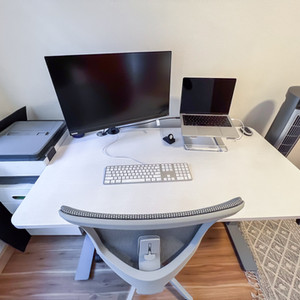
At what (x,y) coordinates should I click in order to perform the action: click on table. Please return your answer as a coordinate pair (x, y). This screenshot has width=300, height=300. Looking at the image, I should click on (263, 176).